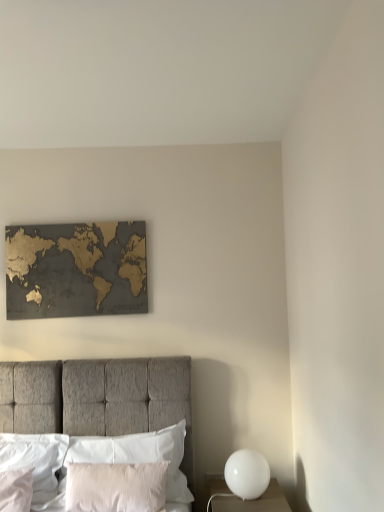
In order to face silky white pillow at center, the 4th pillow when ordered from left to right, should I rotate leftwards or rightwards?

A 9.003 degree turn to the left will do.

You are a GUI agent. You are given a task and a screenshot of the screen. Output one action in this format:
    pyautogui.click(x=<x>, y=<y>)
    Task: Click on the white satin pillow at lower left, the 1th pillow from the left
    
    Given the screenshot: What is the action you would take?
    pyautogui.click(x=16, y=490)

Describe the element at coordinates (38, 465) in the screenshot. I see `white soft pillow at lower left, which is counted as the second pillow, starting from the left` at that location.

What is the approximate width of gold metallic map at upper center?

gold metallic map at upper center is 1.56 inches wide.

You are a GUI agent. You are given a task and a screenshot of the screen. Output one action in this format:
    pyautogui.click(x=<x>, y=<y>)
    Task: Click on the gold metallic map at upper center
    This screenshot has width=384, height=512.
    Given the screenshot: What is the action you would take?
    pyautogui.click(x=76, y=270)

Locate an element on the screen. This screenshot has height=512, width=384. white glossy sphere at lower right is located at coordinates (248, 500).

From the image's perspective, between gold metallic map at upper center and white glossy sphere at lower right, which one is located above?

gold metallic map at upper center is shown above in the image.

From the picture: Which object is positioned more to the left, gold metallic map at upper center or white glossy sphere at lower right?

Positioned to the left is gold metallic map at upper center.

Which of these two, gold metallic map at upper center or white glossy sphere at lower right, is thinner?

gold metallic map at upper center.

From the image's perspective, does pink velvet pillow at lower center, arranged as the second pillow when viewed from the right, appear lower than textured gray bed at center?

Yes.

Is pink velvet pillow at lower center, which is the 3th pillow from left to right, with textured gray bed at center?

No, pink velvet pillow at lower center, which is the 3th pillow from left to right, is not making contact with textured gray bed at center.

Could you tell me if pink velvet pillow at lower center, which is the 3th pillow from left to right, is turned towards textured gray bed at center?

Yes, pink velvet pillow at lower center, which is the 3th pillow from left to right, faces towards textured gray bed at center.

Considering the sizes of white glossy sphere at lower right and white soft pillow at lower left, which is counted as the second pillow, starting from the left, in the image, is white glossy sphere at lower right taller or shorter than white soft pillow at lower left, which is counted as the second pillow, starting from the left,?

Considering their sizes, white glossy sphere at lower right has less height than white soft pillow at lower left, which is counted as the second pillow, starting from the left.

Does white glossy sphere at lower right have a smaller size compared to white soft pillow at lower left, which is counted as the second pillow, starting from the left?

Incorrect, white glossy sphere at lower right is not smaller in size than white soft pillow at lower left, which is counted as the second pillow, starting from the left.

Is white glossy sphere at lower right to the left or to the right of white soft pillow at lower left, which is counted as the second pillow, starting from the left, in the image?

In the image, white glossy sphere at lower right appears on the right side of white soft pillow at lower left, which is counted as the second pillow, starting from the left.

Looking at this image, measure the distance between white glossy sphere at lower right and white soft pillow at lower left, which is counted as the second pillow, starting from the left.

white glossy sphere at lower right is 39.14 inches away from white soft pillow at lower left, which is counted as the second pillow, starting from the left.

Based on the photo, what's the angular difference between textured gray bed at center and gold metallic map at upper center's facing directions?

0.617 degrees.

Which object is thinner, textured gray bed at center or gold metallic map at upper center?

Thinner between the two is gold metallic map at upper center.

From the image's perspective, which object appears higher, textured gray bed at center or gold metallic map at upper center?

From the image's view, gold metallic map at upper center is above.

From a real-world perspective, who is located lower, textured gray bed at center or gold metallic map at upper center?

textured gray bed at center.

Does pink velvet pillow at lower center, which is the 3th pillow from left to right, turn towards white satin pillow at lower left, the 1th pillow from the left?

No, pink velvet pillow at lower center, which is the 3th pillow from left to right, is not turned towards white satin pillow at lower left, the 1th pillow from the left.

Considering the relative positions of pink velvet pillow at lower center, which is the 3th pillow from left to right, and white satin pillow at lower left, the 4th pillow in the right-to-left sequence, in the image provided, is pink velvet pillow at lower center, which is the 3th pillow from left to right, behind white satin pillow at lower left, the 4th pillow in the right-to-left sequence,?

No, pink velvet pillow at lower center, which is the 3th pillow from left to right, is in front of white satin pillow at lower left, the 4th pillow in the right-to-left sequence.

Between pink velvet pillow at lower center, which is the 3th pillow from left to right, and white satin pillow at lower left, the 4th pillow in the right-to-left sequence, which one has more height?

Standing taller between the two is pink velvet pillow at lower center, which is the 3th pillow from left to right.

Consider the image. Considering the sizes of pink velvet pillow at lower center, which is the 3th pillow from left to right, and white satin pillow at lower left, the 1th pillow from the left, in the image, is pink velvet pillow at lower center, which is the 3th pillow from left to right, bigger or smaller than white satin pillow at lower left, the 1th pillow from the left,?

In the image, pink velvet pillow at lower center, which is the 3th pillow from left to right, appears to be larger than white satin pillow at lower left, the 1th pillow from the left.

Visually, is white satin pillow at lower left, the 1th pillow from the left, positioned to the left or to the right of silky white pillow at center, the 4th pillow when ordered from left to right?

white satin pillow at lower left, the 1th pillow from the left, is to the left of silky white pillow at center, the 4th pillow when ordered from left to right.

Consider the image. Between white satin pillow at lower left, the 1th pillow from the left, and silky white pillow at center, the 1th pillow in the right-to-left sequence, which one is positioned behind?

Positioned behind is silky white pillow at center, the 1th pillow in the right-to-left sequence.

Who is smaller, white satin pillow at lower left, the 1th pillow from the left, or silky white pillow at center, the 4th pillow when ordered from left to right?

white satin pillow at lower left, the 1th pillow from the left.

What's the angular difference between white glossy sphere at lower right and silky white pillow at center, the 1th pillow in the right-to-left sequence,'s facing directions?

The angular difference between white glossy sphere at lower right and silky white pillow at center, the 1th pillow in the right-to-left sequence, is 0.187 degrees.

From the image's perspective, does white glossy sphere at lower right appear higher than silky white pillow at center, the 4th pillow when ordered from left to right?

No.

Which of these two, white glossy sphere at lower right or silky white pillow at center, the 4th pillow when ordered from left to right, is wider?

white glossy sphere at lower right is wider.

Can you confirm if white glossy sphere at lower right is positioned to the right of silky white pillow at center, the 4th pillow when ordered from left to right?

Correct, you'll find white glossy sphere at lower right to the right of silky white pillow at center, the 4th pillow when ordered from left to right.

I want to click on picture frame behind the white glossy sphere at lower right, so click(76, 270).

Find the location of a particular element. bed above the pink velvet pillow at lower center, arranged as the second pillow when viewed from the right (from the image's perspective) is located at coordinates (98, 398).

From the picture: Based on their spatial positions, is white soft pillow at lower left, which is counted as the second pillow, starting from the left, or white glossy sphere at lower right closer to textured gray bed at center?

white soft pillow at lower left, which is counted as the second pillow, starting from the left, is positioned closer to the anchor textured gray bed at center.

Based on their spatial positions, is white glossy sphere at lower right or white glossy sphere at lower right closer to white satin pillow at lower left, the 1th pillow from the left?

Based on the image, white glossy sphere at lower right appears to be nearer to white satin pillow at lower left, the 1th pillow from the left.

Considering their positions, is white soft pillow at lower left, which is counted as the second pillow, starting from the left, positioned further to silky white pillow at center, the 4th pillow when ordered from left to right, than gold metallic map at upper center?

gold metallic map at upper center lies further to silky white pillow at center, the 4th pillow when ordered from left to right, than the other object.

Estimate the real-world distances between objects in this image. Which object is closer to textured gray bed at center, pink velvet pillow at lower center, which is the 3th pillow from left to right, or gold metallic map at upper center?

pink velvet pillow at lower center, which is the 3th pillow from left to right, is closer to textured gray bed at center.

When comparing their distances from pink velvet pillow at lower center, arranged as the second pillow when viewed from the right, does white satin pillow at lower left, the 4th pillow in the right-to-left sequence, or textured gray bed at center seem further?

white satin pillow at lower left, the 4th pillow in the right-to-left sequence, is further to pink velvet pillow at lower center, arranged as the second pillow when viewed from the right.

Which object lies nearer to the anchor point pink velvet pillow at lower center, which is the 3th pillow from left to right, white glossy sphere at lower right or textured gray bed at center?

Among the two, textured gray bed at center is located nearer to pink velvet pillow at lower center, which is the 3th pillow from left to right.

Considering their positions, is silky white pillow at center, the 4th pillow when ordered from left to right, positioned further to white satin pillow at lower left, the 1th pillow from the left, than gold metallic map at upper center?

gold metallic map at upper center lies further to white satin pillow at lower left, the 1th pillow from the left, than the other object.

When comparing their distances from white soft pillow at lower left, which is counted as the second pillow, starting from the left, does white glossy sphere at lower right or textured gray bed at center seem further?

white glossy sphere at lower right lies further to white soft pillow at lower left, which is counted as the second pillow, starting from the left, than the other object.

The height and width of the screenshot is (512, 384). I want to click on nightstand positioned between textured gray bed at center and gold metallic map at upper center from near to far, so click(248, 500).

Where is `nightstand between textured gray bed at center and white soft pillow at lower left, which is the third pillow from right to left, from front to back`? The image size is (384, 512). nightstand between textured gray bed at center and white soft pillow at lower left, which is the third pillow from right to left, from front to back is located at coordinates (248, 500).

What are the coordinates of `pillow situated between pink velvet pillow at lower center, which is the 3th pillow from left to right, and white glossy sphere at lower right from left to right` in the screenshot? It's located at (138, 454).

Locate an element on the screen. This screenshot has width=384, height=512. pillow between white soft pillow at lower left, which is counted as the second pillow, starting from the left, and silky white pillow at center, the 4th pillow when ordered from left to right, from left to right is located at coordinates (116, 487).